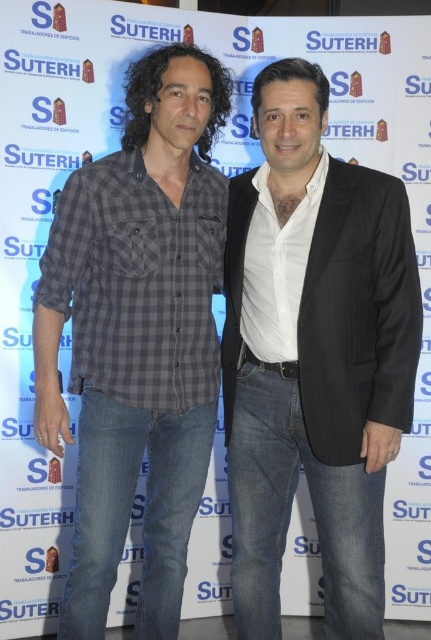
Who is more forward, (287, 125) or (80, 609)?

Positioned in front is point (287, 125).

Can you confirm if white smooth shirt at center is wider than gray checkered shirt at center?

Incorrect, white smooth shirt at center's width does not surpass gray checkered shirt at center's.

Find the location of a particular element. This screenshot has width=431, height=640. white smooth shirt at center is located at coordinates (314, 355).

Locate an element on the screen. white smooth shirt at center is located at coordinates (314, 355).